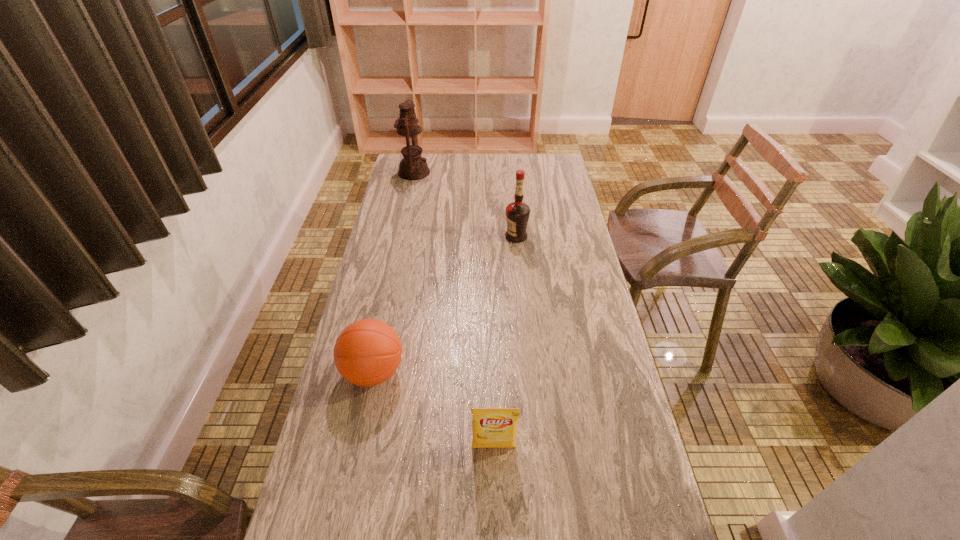
Where is `free spot between the oil lamp and the liquor`? This screenshot has height=540, width=960. free spot between the oil lamp and the liquor is located at coordinates (466, 204).

Locate an element on the screen. vacant area that lies between the second farthest object and the basketball is located at coordinates (444, 304).

The height and width of the screenshot is (540, 960). Identify the location of unoccupied area between the oil lamp and the liquor. (466, 204).

Identify the location of free spot between the oil lamp and the second nearest object. This screenshot has height=540, width=960. (394, 272).

Where is `vacant point located between the farthest object and the crisp (potato chip)`? The image size is (960, 540). vacant point located between the farthest object and the crisp (potato chip) is located at coordinates (454, 310).

Image resolution: width=960 pixels, height=540 pixels. I want to click on free spot between the second farthest object and the basketball, so click(x=444, y=304).

I want to click on vacant space that's between the liquor and the third farthest object, so click(444, 304).

Where is `empty space between the second farthest object and the nearest object`? The width and height of the screenshot is (960, 540). empty space between the second farthest object and the nearest object is located at coordinates (505, 342).

Where is `unoccupied position between the nearest object and the liquor`? The image size is (960, 540). unoccupied position between the nearest object and the liquor is located at coordinates (505, 342).

At what (x,y) coordinates should I click in order to perform the action: click on free spot between the rightmost object and the farthest object. Please return your answer as a coordinate pair (x, y). The image size is (960, 540). Looking at the image, I should click on (466, 204).